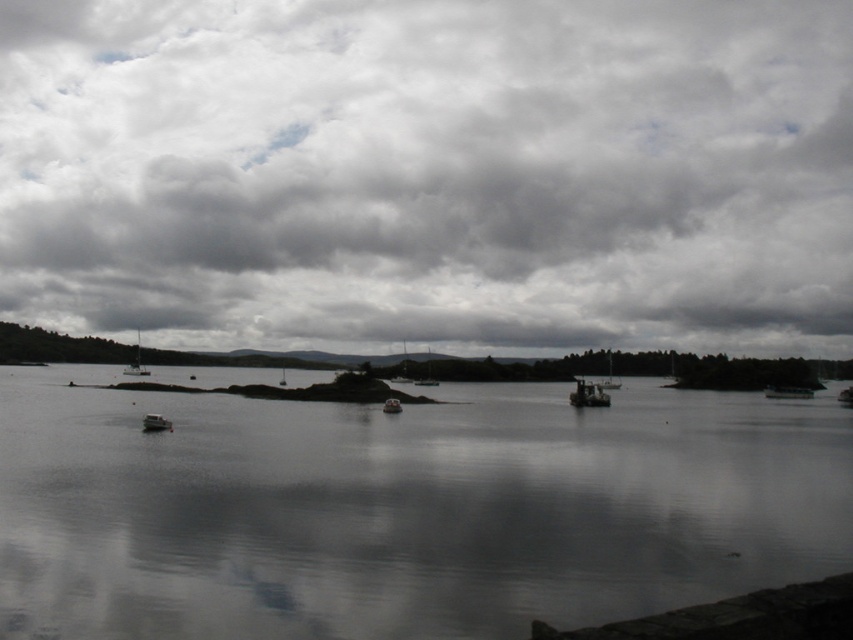
You are standing on the dock and see the smooth water at center and the white glossy sailboat at left. Which object is taller?

The white glossy sailboat at left is taller than the smooth water at center.

You are standing at the edge of the water and want to reach a specific location marked by point (129, 371). If your boat can travel 100 feet per minute, how many minutes will it take to reach the point?

The point (129, 371) is 546.72 feet away from the viewer. At a speed of 100 feet per minute, it will take approximately 5.47 minutes to reach the point.